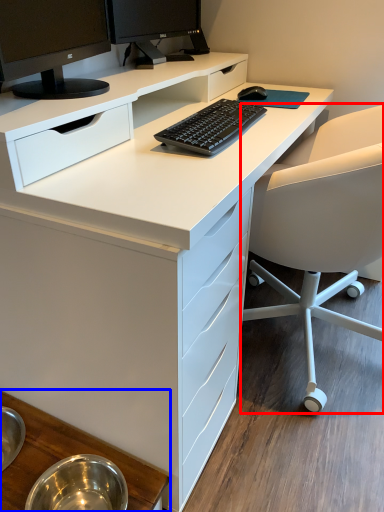
Question: Which point is further to the camera, chair (highlighted by a red box) or table (highlighted by a blue box)?

Choices:
 (A) chair
 (B) table

Answer: (A)